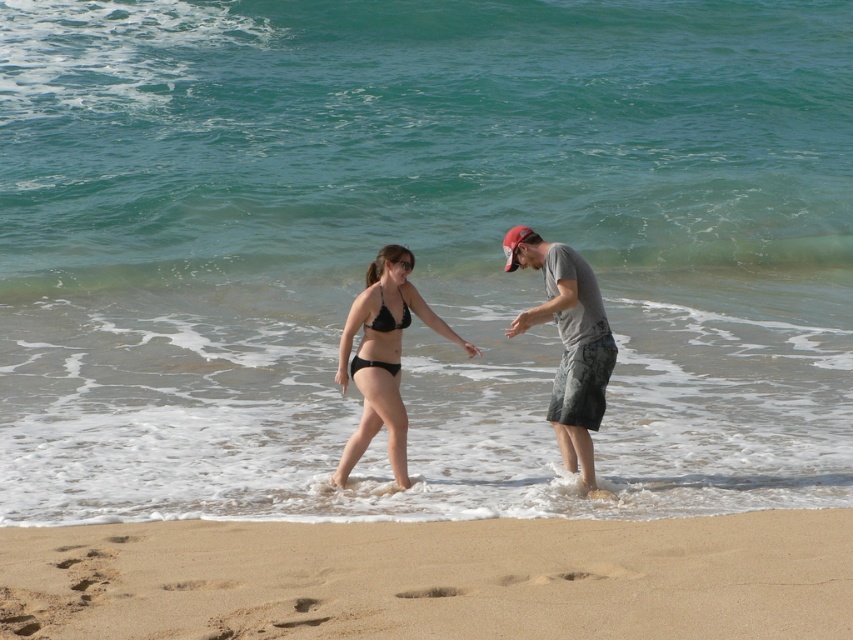
Can you confirm if matte black bikini at center is wider than gray cotton t-shirt at center?

→ Yes.

Is point (601, 392) behind point (587, 316)?

Yes, point (601, 392) is farther from viewer.

Who is more forward, (426,314) or (567,394)?

Point (567,394) is more forward.

I want to click on matte black bikini at center, so click(x=582, y=410).

Consider the image. Can you confirm if fine-grained golden sand at lower center is positioned above red fabric baseball cap at upper right?

No, fine-grained golden sand at lower center is not above red fabric baseball cap at upper right.

Looking at this image, is fine-grained golden sand at lower center further to the viewer compared to red fabric baseball cap at upper right?

No, it is not.

This screenshot has height=640, width=853. Identify the location of fine-grained golden sand at lower center. (434, 579).

Can you confirm if fine-grained golden sand at lower center is shorter than black matte bikini at center?

Indeed, fine-grained golden sand at lower center has a lesser height compared to black matte bikini at center.

Is point (86, 536) closer to camera compared to point (370, 403)?

Yes, point (86, 536) is closer to viewer.

At what (x,y) coordinates should I click in order to perform the action: click on fine-grained golden sand at lower center. Please return your answer as a coordinate pair (x, y). Looking at the image, I should click on (434, 579).